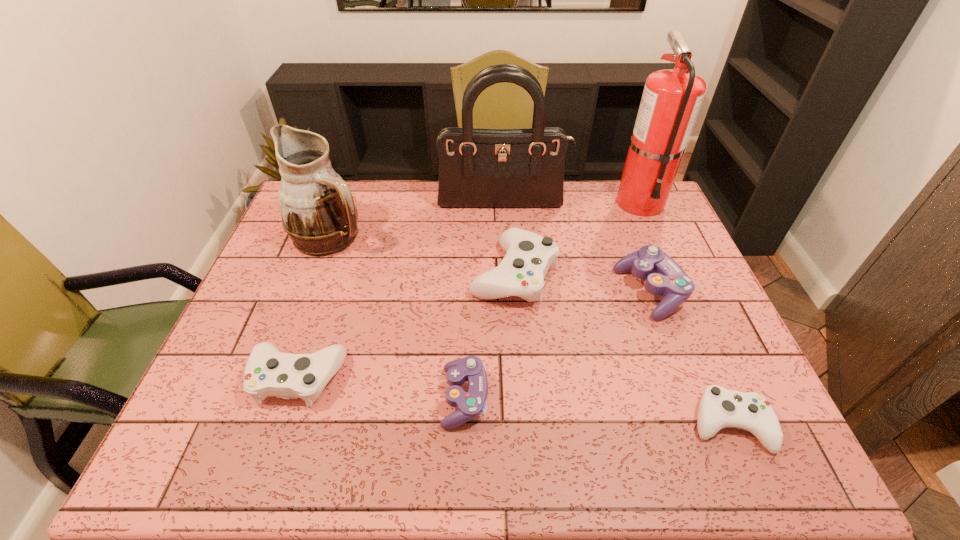
The height and width of the screenshot is (540, 960). In order to click on free region that satisfies the following two spatial constraints: 1. at the nozzle of the red fire extinguisher; 2. from the spout of the pitcher in this screenshot , I will do `click(655, 236)`.

I want to click on free spot that satisfies the following two spatial constraints: 1. from the spout of the farthest white control; 2. on the left side of the brown pitcher, so click(x=318, y=274).